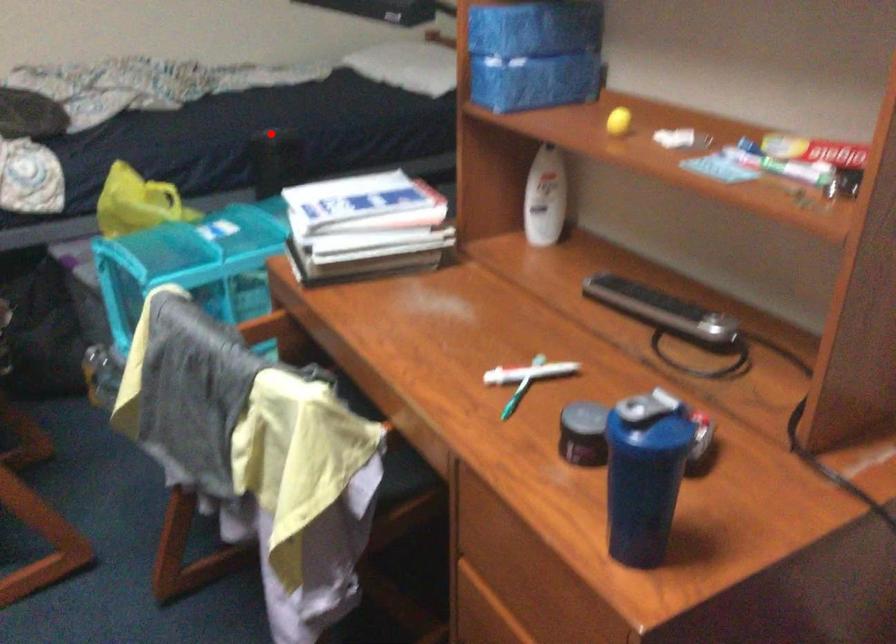
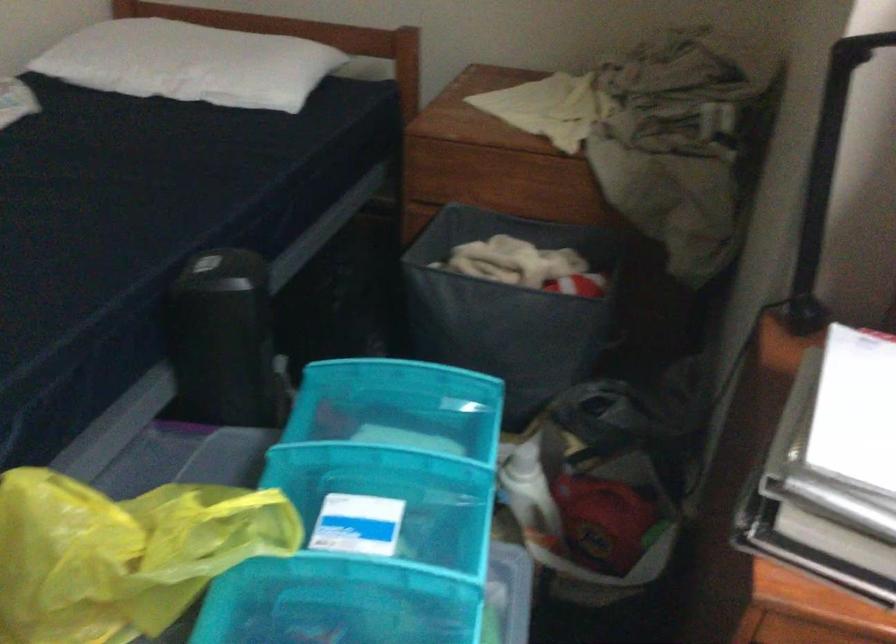
Question: I am providing you with two images of the same scene from different viewpoints. Image1 has a red point marked. In image2, the corresponding 3D location appears at what relative position? Reply with the corresponding letter.

Choices:
 (A) Closer
 (B) Farther

Answer: (A)